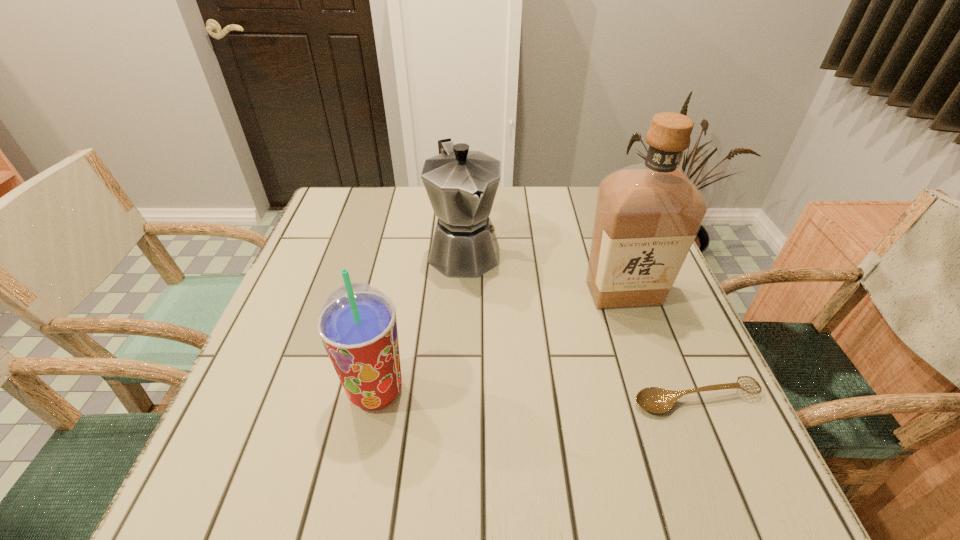
You are a GUI agent. You are given a task and a screenshot of the screen. Output one action in this format:
    pyautogui.click(x=<x>, y=<y>)
    Task: Click on the free space at the left edge of the desktop
    This screenshot has width=960, height=540.
    Given the screenshot: What is the action you would take?
    pyautogui.click(x=291, y=390)

You are a GUI agent. You are given a task and a screenshot of the screen. Output one action in this format:
    pyautogui.click(x=<x>, y=<y>)
    Task: Click on the vacant space at the right edge
    The image size is (960, 540).
    Given the screenshot: What is the action you would take?
    pyautogui.click(x=589, y=241)

At what (x,y) coordinates should I click in order to perform the action: click on free space at the far left corner of the desktop. Please return your answer as a coordinate pair (x, y). Looking at the image, I should click on (342, 191).

Where is `free spot between the smoothie and the ladle`? This screenshot has height=540, width=960. free spot between the smoothie and the ladle is located at coordinates (536, 395).

Where is `free space between the liquor and the ladle`? Image resolution: width=960 pixels, height=540 pixels. free space between the liquor and the ladle is located at coordinates (660, 346).

Find the location of `free space between the ladle and the third object from right to left`. free space between the ladle and the third object from right to left is located at coordinates tap(580, 325).

The image size is (960, 540). In order to click on free area in between the liquor and the second object from left to right in this screenshot , I will do `click(544, 272)`.

Find the location of a particular element. This screenshot has height=540, width=960. free space between the coffeepot and the liquor is located at coordinates click(544, 272).

The width and height of the screenshot is (960, 540). In order to click on free point between the tallest object and the second object from left to right in this screenshot , I will do `click(544, 272)`.

At what (x,y) coordinates should I click in order to perform the action: click on blank region between the liquor and the smoothie. Please return your answer as a coordinate pair (x, y). Looking at the image, I should click on (499, 342).